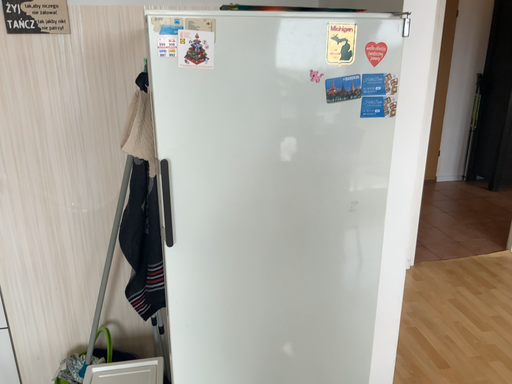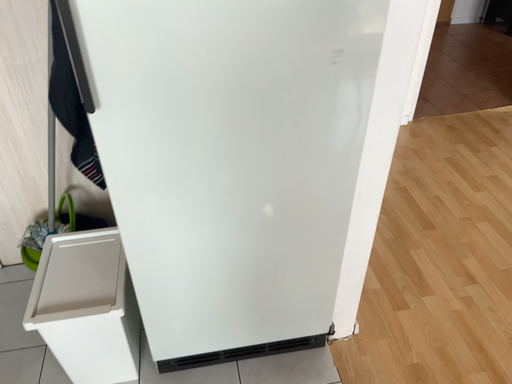
Question: Which way did the camera rotate in the video?

Choices:
 (A) rotated upward
 (B) rotated downward

Answer: (B)